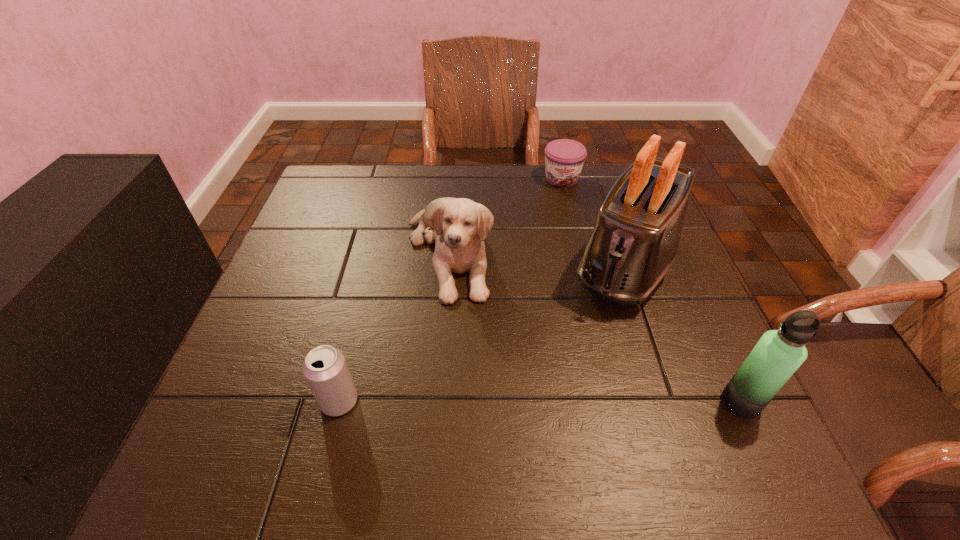
The height and width of the screenshot is (540, 960). In the image, there is a desktop. Identify the location of vacant space at the far left corner. (348, 175).

Where is `free region at the far right corner`? The image size is (960, 540). free region at the far right corner is located at coordinates (600, 176).

Where is `empty space that is in between the second tallest object and the beer can`? empty space that is in between the second tallest object and the beer can is located at coordinates (540, 401).

In order to click on free space between the fourth tallest object and the second object from left to right in this screenshot , I will do `click(394, 327)`.

The width and height of the screenshot is (960, 540). I want to click on empty location between the beer can and the thermos bottle, so click(x=540, y=401).

Find the location of a particular element. vacant space that is in between the thermos bottle and the puppy is located at coordinates (595, 327).

Where is `empty space that is in between the beer can and the tallest object`? This screenshot has width=960, height=540. empty space that is in between the beer can and the tallest object is located at coordinates (483, 333).

Find the location of a particular element. vacant point located between the puppy and the tallest object is located at coordinates (538, 259).

I want to click on free area in between the fourth object from right to left and the shortest object, so click(505, 215).

At what (x,y) coordinates should I click in order to perform the action: click on vacant space in between the third tallest object and the second shortest object. Please return your answer as a coordinate pair (x, y). The height and width of the screenshot is (540, 960). Looking at the image, I should click on (394, 327).